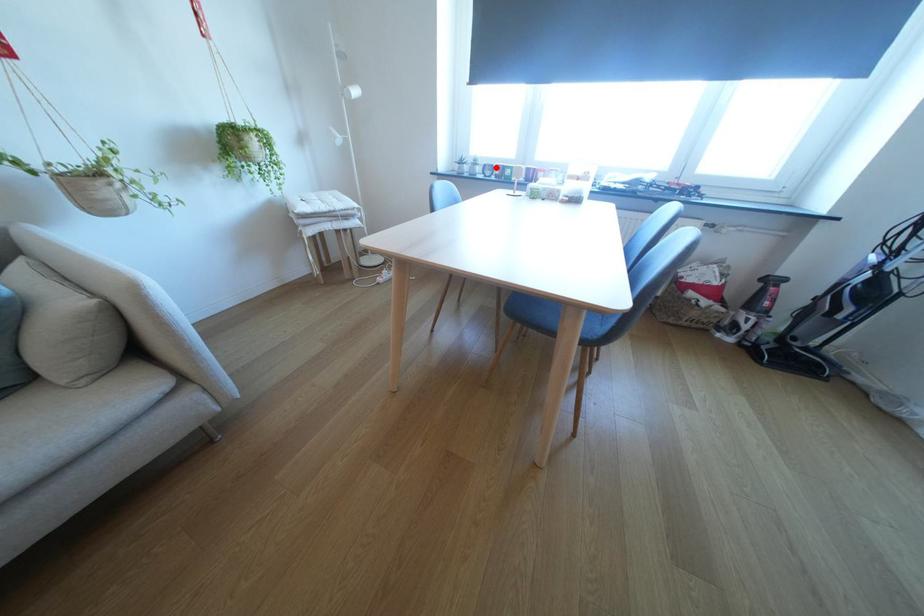
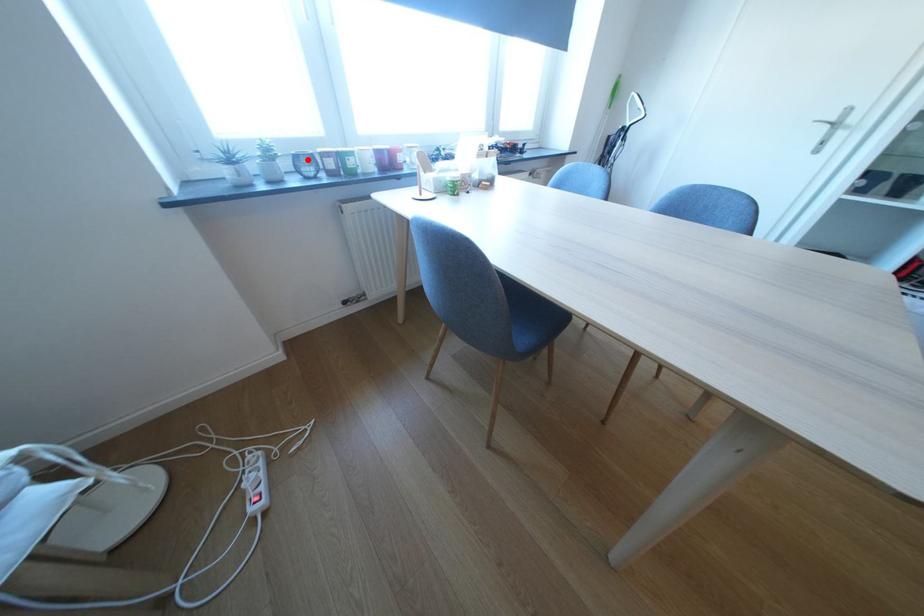
Looking at this image, I am providing you with two images of the same scene from different viewpoints. A red point is marked on the first image and another point is marked on the second image. Is the red point in image1 aligned with the point shown in image2?

Yes